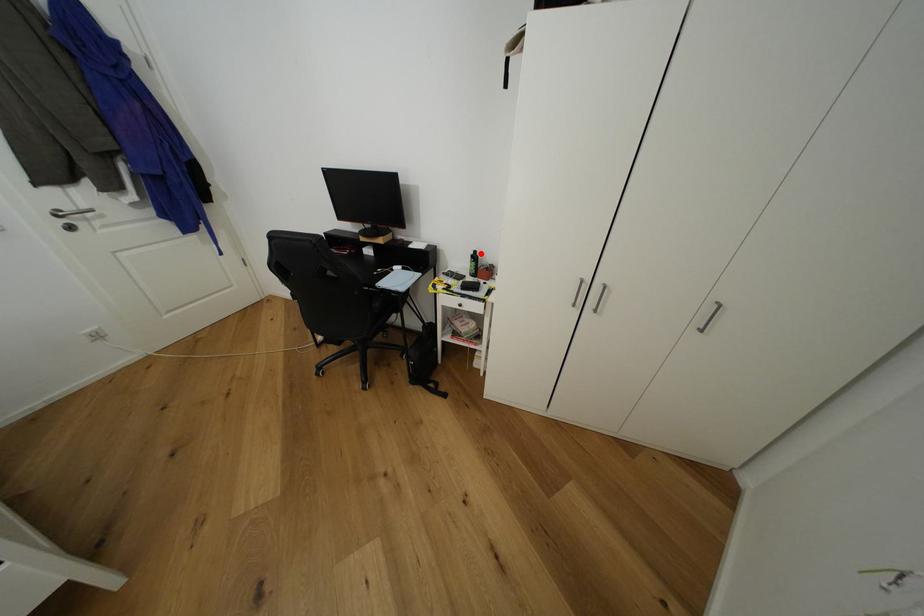
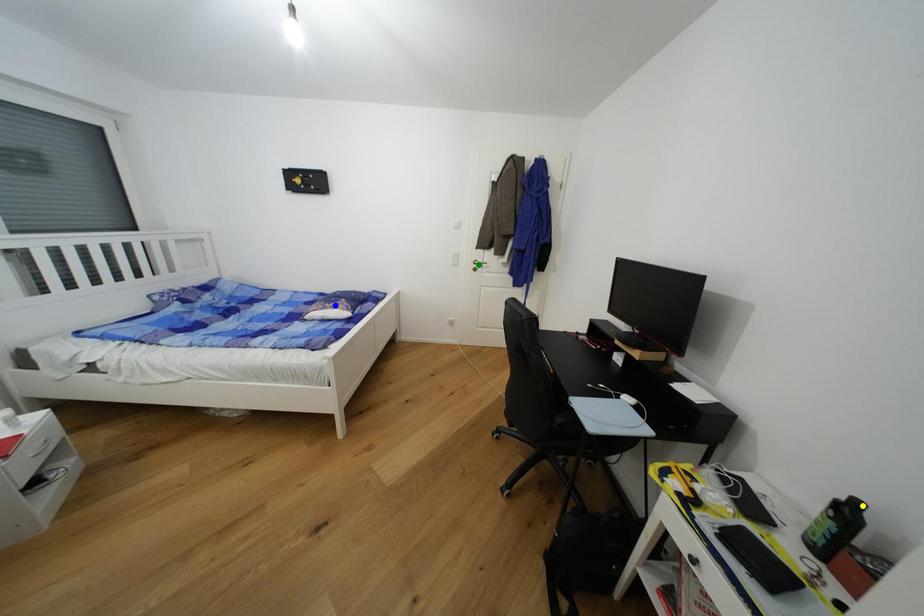
Question: I am providing you with two images of the same scene from different viewpoints. A red point is marked on the first image. You are given multiple points on the second image. Which mark in image 2 goes with the point in image 1?

Choices:
 (A) green point
 (B) blue point
 (C) yellow point

Answer: (C)